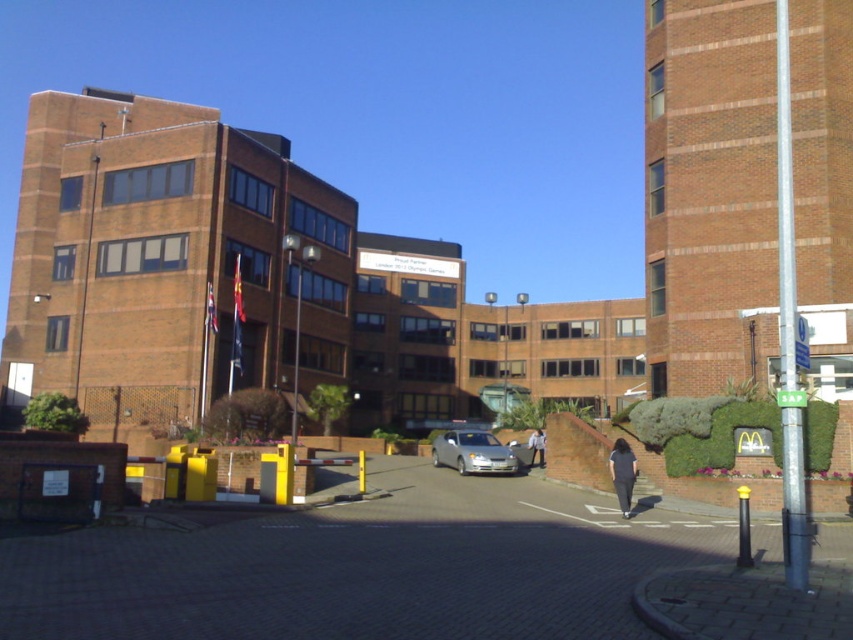
Does silver metallic car at center have a lesser width compared to light blue denim jacket at center?

No.

Describe the element at coordinates (473, 452) in the screenshot. I see `silver metallic car at center` at that location.

This screenshot has height=640, width=853. I want to click on silver metallic car at center, so click(x=473, y=452).

From the picture: Can you confirm if silver metallic car at center is positioned to the left of light brown leather jacket at center?

Yes, silver metallic car at center is to the left of light brown leather jacket at center.

Is point (471, 474) positioned behind point (534, 433)?

No, it is not.

The image size is (853, 640). Find the location of `silver metallic car at center`. silver metallic car at center is located at coordinates (473, 452).

Does silver metallic car at center have a lesser height compared to dark gray fabric pants at lower center?

No, silver metallic car at center is not shorter than dark gray fabric pants at lower center.

Is point (477, 472) positioned behind point (624, 472)?

Yes, it is behind point (624, 472).

Is point (463, 438) more distant than point (627, 499)?

Yes.

I want to click on silver metallic car at center, so click(473, 452).